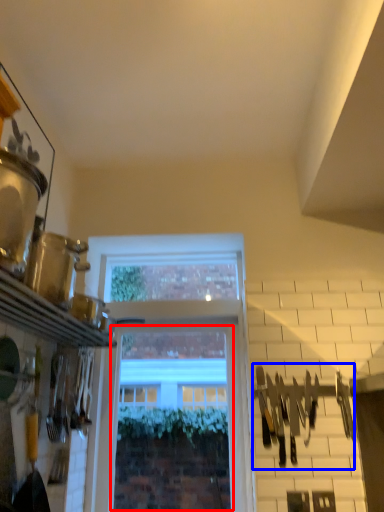
Question: Which point is closer to the camera, window (highlighted by a red box) or tool (highlighted by a blue box)?

Choices:
 (A) window
 (B) tool

Answer: (B)